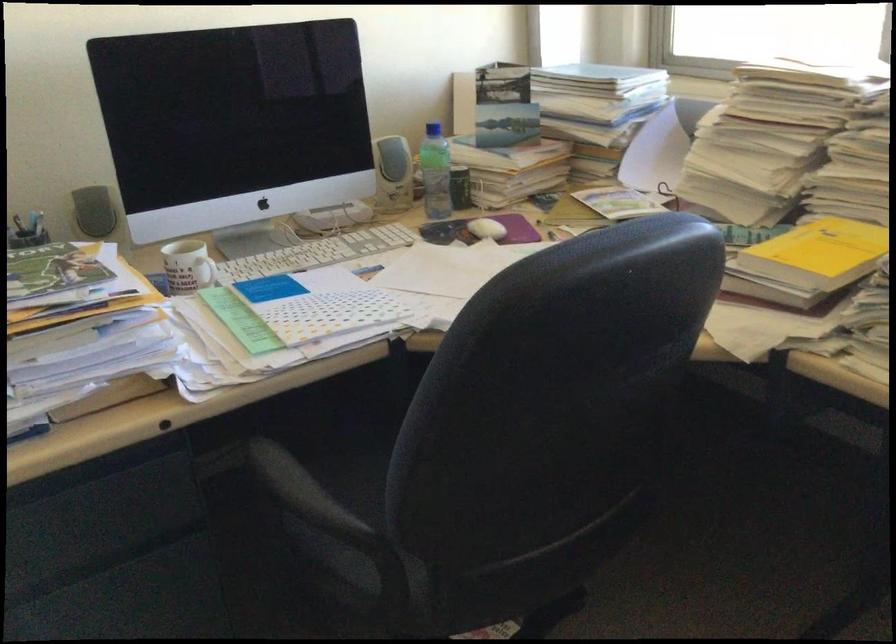
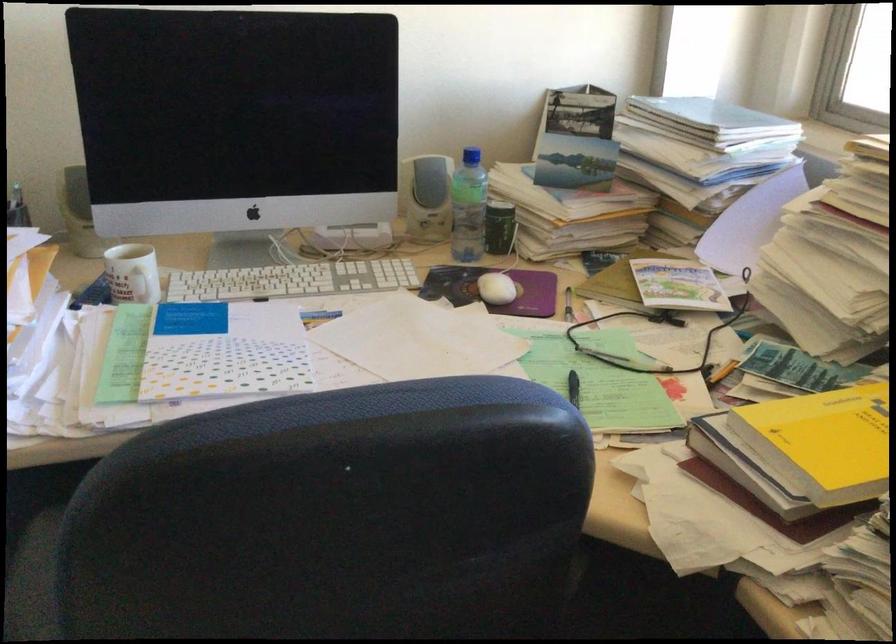
Question: Based on the continuous images, in which direction is the camera rotating? Reply with the corresponding letter.

Choices:
 (A) Left
 (B) Right
 (C) Up
 (D) Down

Answer: (A)